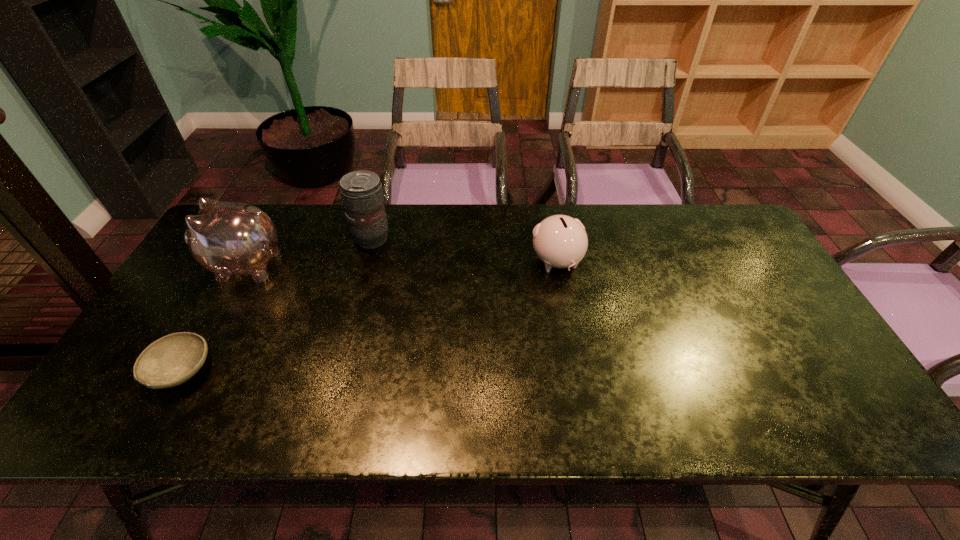
Image resolution: width=960 pixels, height=540 pixels. Find the location of `the second object from right to left`. the second object from right to left is located at coordinates (362, 194).

Locate an element on the screen. the taller piggy bank is located at coordinates (227, 238).

Where is `the rightmost object`? The height and width of the screenshot is (540, 960). the rightmost object is located at coordinates (560, 241).

Image resolution: width=960 pixels, height=540 pixels. What are the coordinates of `the shorter piggy bank` in the screenshot? It's located at (560, 241).

The height and width of the screenshot is (540, 960). Identify the location of the shortest object. (170, 361).

I want to click on the nearest object, so click(170, 361).

Image resolution: width=960 pixels, height=540 pixels. In order to click on vacant space located on the side of the second object from right to left where the control switches are located in this screenshot , I will do `click(436, 239)`.

Where is `free space located 0.360m on the left of the rightmost object`? The image size is (960, 540). free space located 0.360m on the left of the rightmost object is located at coordinates (409, 262).

The width and height of the screenshot is (960, 540). I want to click on vacant space situated 0.050m on the front of the nearest object, so click(x=154, y=421).

Find the location of `telephoto lens present at the far edge`. telephoto lens present at the far edge is located at coordinates (362, 194).